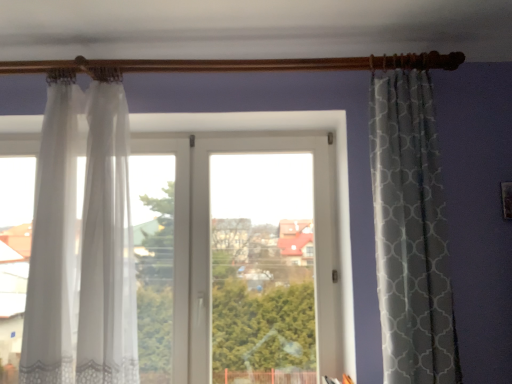
Question: From a real-world perspective, is transparent fabric window at center positioned over sheer white curtain at left, positioned as the 2th curtain in right-to-left order, based on gravity?

Choices:
 (A) yes
 (B) no

Answer: (B)

Question: Does transparent fabric window at center have a greater width compared to sheer white curtain at left, the 1th curtain positioned from the left?

Choices:
 (A) yes
 (B) no

Answer: (B)

Question: Is transparent fabric window at center with sheer white curtain at left, the 1th curtain positioned from the left?

Choices:
 (A) yes
 (B) no

Answer: (B)

Question: Is sheer white curtain at left, positioned as the 2th curtain in right-to-left order, located within transparent fabric window at center?

Choices:
 (A) yes
 (B) no

Answer: (B)

Question: Is transparent fabric window at center facing towards sheer white curtain at left, the 1th curtain positioned from the left?

Choices:
 (A) yes
 (B) no

Answer: (A)

Question: Is transparent fabric window at center turned away from sheer white curtain at left, positioned as the 2th curtain in right-to-left order?

Choices:
 (A) no
 (B) yes

Answer: (B)

Question: Is white sheer curtain at left, marked as the second curtain in a left-to-right arrangement, wider than transparent fabric window at center?

Choices:
 (A) no
 (B) yes

Answer: (B)

Question: Does white sheer curtain at left, which is counted as the first curtain, starting from the right, have a lesser width compared to transparent fabric window at center?

Choices:
 (A) no
 (B) yes

Answer: (A)

Question: Is white sheer curtain at left, marked as the second curtain in a left-to-right arrangement, at the left side of transparent fabric window at center?

Choices:
 (A) no
 (B) yes

Answer: (B)

Question: From a real-world perspective, is white sheer curtain at left, which is counted as the first curtain, starting from the right, positioned under transparent fabric window at center based on gravity?

Choices:
 (A) no
 (B) yes

Answer: (A)

Question: Is white sheer curtain at left, marked as the second curtain in a left-to-right arrangement, aimed at transparent fabric window at center?

Choices:
 (A) no
 (B) yes

Answer: (B)

Question: From the image's perspective, is white sheer curtain at left, which is counted as the first curtain, starting from the right, below transparent fabric window at center?

Choices:
 (A) yes
 (B) no

Answer: (B)

Question: Could you tell me if sheer white curtain at left, positioned as the 2th curtain in right-to-left order, is turned towards white sheer curtain at left, marked as the second curtain in a left-to-right arrangement?

Choices:
 (A) no
 (B) yes

Answer: (A)